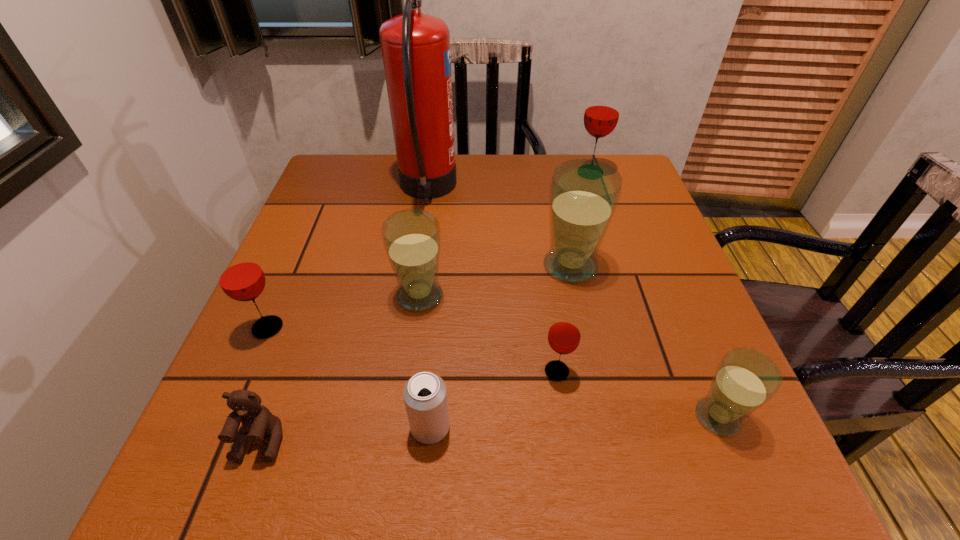
Find the location of a particular element. Image resolution: width=960 pixels, height=540 pixels. blank region between the second biggest blue glass and the white beer can is located at coordinates (425, 361).

This screenshot has height=540, width=960. In order to click on vacant space that's between the fifth glass from right to left and the teddy bear in this screenshot , I will do (341, 368).

The image size is (960, 540). In order to click on vacant region between the teddy bear and the biggest blue glass in this screenshot , I will do `click(416, 353)`.

You are a GUI agent. You are given a task and a screenshot of the screen. Output one action in this format:
    pyautogui.click(x=<x>, y=<y>)
    Task: Click on the vacant point located between the nearest red glass and the leftmost glass
    The height and width of the screenshot is (540, 960).
    Given the screenshot: What is the action you would take?
    pyautogui.click(x=412, y=349)

Where is `free space between the second blue glass from right to left and the teddy bear`? free space between the second blue glass from right to left and the teddy bear is located at coordinates (416, 353).

This screenshot has width=960, height=540. I want to click on the fifth closest object to the leftmost blue glass, so click(564, 335).

Point out which object is positioned as the third nearest to the biggest blue glass. Please provide its 2D coordinates. Your answer should be formatted as a tuple, i.e. [(x, y)], where the tuple contains the x and y coordinates of a point satisfying the conditions above.

[(415, 47)]

Locate which glass is the fifth closest to the teddy bear. Please provide its 2D coordinates. Your answer should be formatted as a tuple, i.e. [(x, y)], where the tuple contains the x and y coordinates of a point satisfying the conditions above.

[(745, 379)]

At what (x,y) coordinates should I click in order to perform the action: click on the fifth closest glass to the farthest glass. Please return your answer as a coordinate pair (x, y). Looking at the image, I should click on (240, 276).

Locate an element on the screen. The image size is (960, 540). the third closest red glass to the second blue glass from left to right is located at coordinates (240, 276).